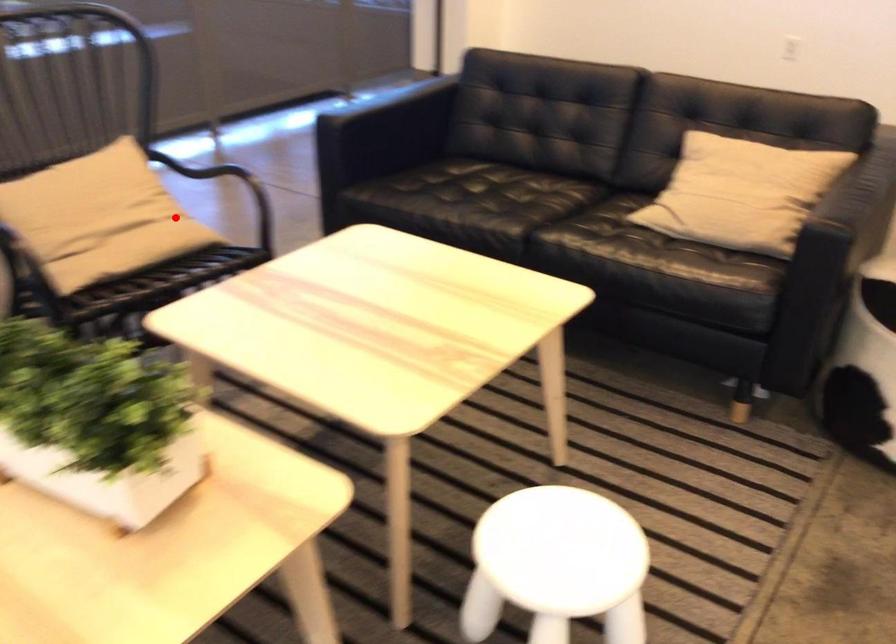
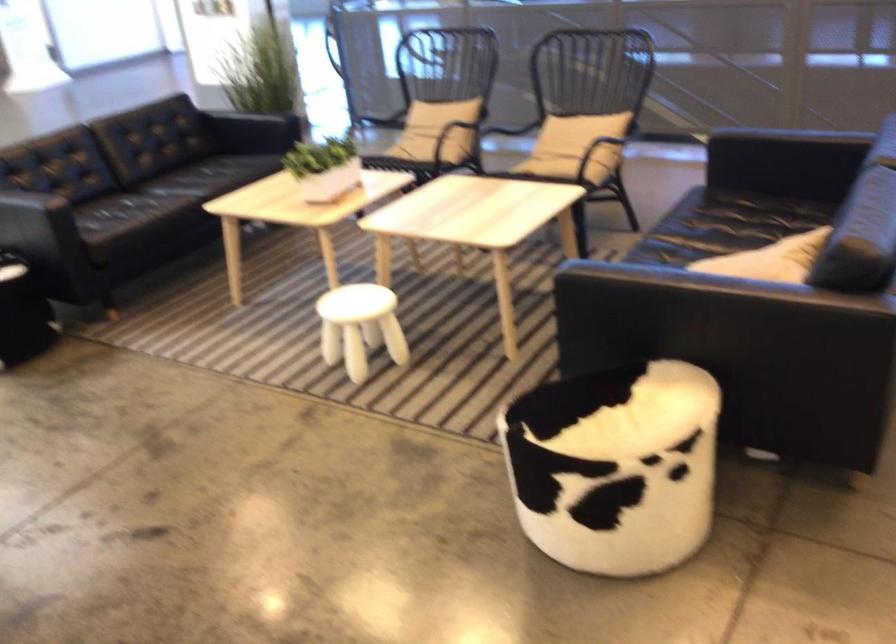
The point at the highlighted location is marked in the first image. Where is the corresponding point in the second image?

(574, 147)